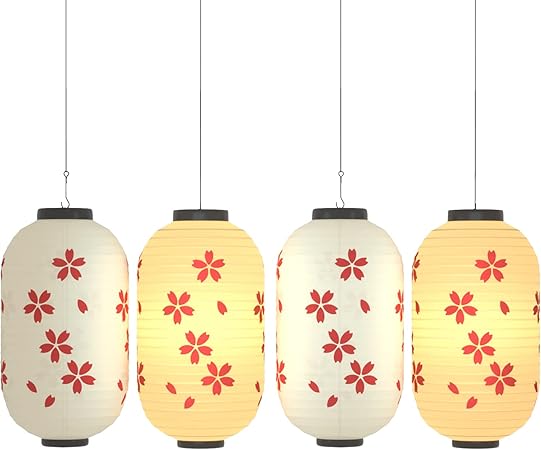
The image size is (541, 450). I want to click on yellow lantern, so click(x=239, y=419), click(x=479, y=421).